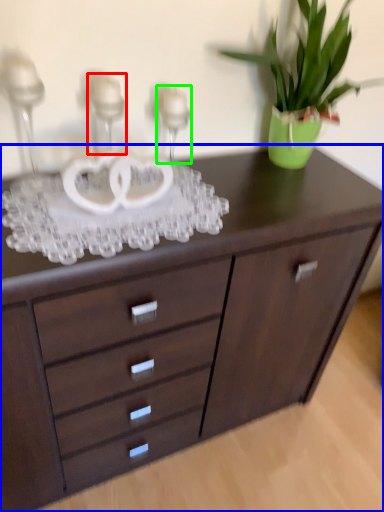
Question: Which is nearer to the candle holder (highlighted by a red box)? chest of drawers (highlighted by a blue box) or candle holder (highlighted by a green box).

Choices:
 (A) chest of drawers
 (B) candle holder

Answer: (B)